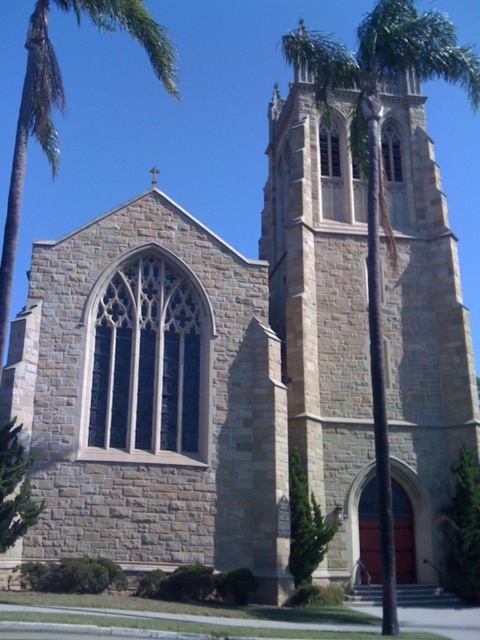
Question: Does green leafy palm tree at center appear on the left side of green textured bush at lower center?

Choices:
 (A) no
 (B) yes

Answer: (A)

Question: Is green leafy tree at center to the right of green textured bush at lower center from the viewer's perspective?

Choices:
 (A) yes
 (B) no

Answer: (A)

Question: Estimate the real-world distances between objects in this image. Which object is closer to the green leafy tree at center?

Choices:
 (A) green leafy palm tree at center
 (B) green textured bush at lower center

Answer: (B)

Question: Which object is positioned closest to the green textured bush at lower center?

Choices:
 (A) green leafy palm tree at center
 (B) green leafy tree at center

Answer: (B)

Question: Estimate the real-world distances between objects in this image. Which object is closer to the green textured bush at lower center?

Choices:
 (A) green leafy tree at center
 (B) green leafy palm tree at center

Answer: (A)

Question: Is green leafy palm tree at center closer to camera compared to green leafy tree at center?

Choices:
 (A) no
 (B) yes

Answer: (B)